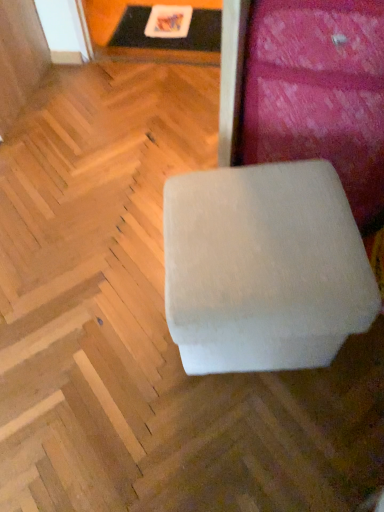
The height and width of the screenshot is (512, 384). I want to click on vacant space situated above white fabric ottoman at center, which appears as the 1th furniture when ordered from the bottom (from a real-world perspective), so point(251,222).